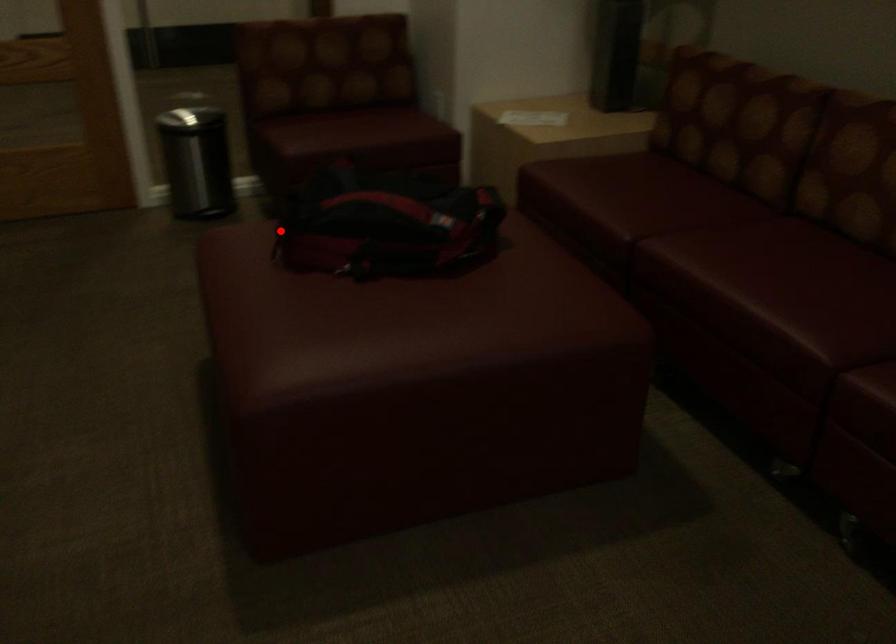
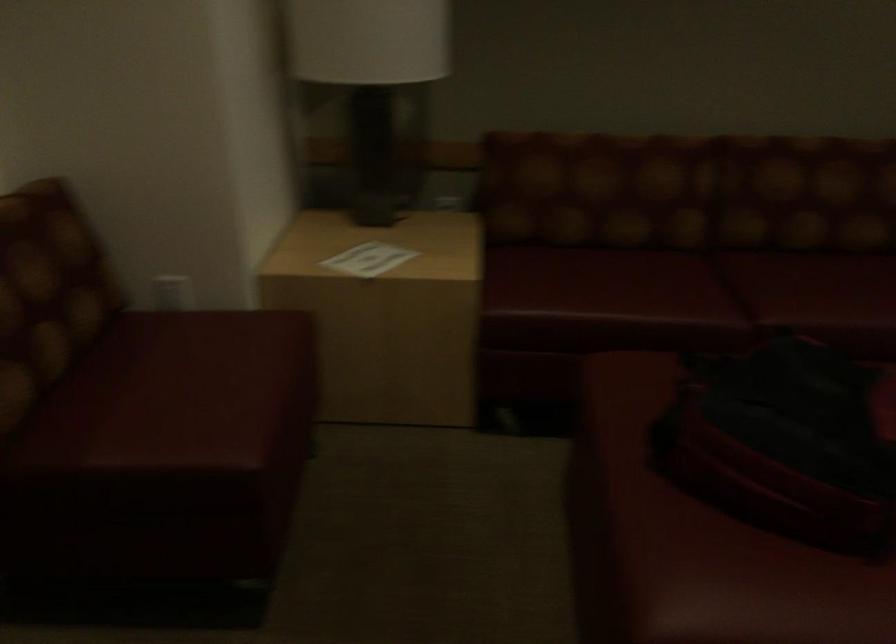
The point at the highlighted location is marked in the first image. Where is the corresponding point in the second image?

(693, 541)